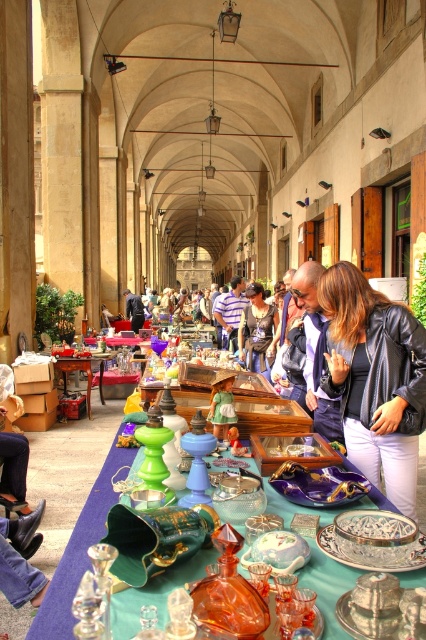
Question: Does striped fabric shirt at center appear on the right side of green glass table at center?

Choices:
 (A) no
 (B) yes

Answer: (B)

Question: Among these points, which one is nearest to the camera?

Choices:
 (A) (141, 307)
 (B) (94, 358)
 (C) (241, 289)
 (D) (224, 387)

Answer: (D)

Question: Which object is farther from the camera taking this photo?

Choices:
 (A) brushed metal water at bottle left
 (B) green glass table at center
 (C) matte black jacket at center

Answer: (A)

Question: Can you confirm if matte black jacket at center is positioned below green glass table at center?

Choices:
 (A) no
 (B) yes

Answer: (A)

Question: Is striped fabric shirt at center bigger than green glass table at center?

Choices:
 (A) no
 (B) yes

Answer: (B)

Question: Among these points, which one is nearest to the camera?

Choices:
 (A) (85, 362)
 (B) (224, 422)
 (C) (224, 337)
 (D) (129, 314)

Answer: (B)